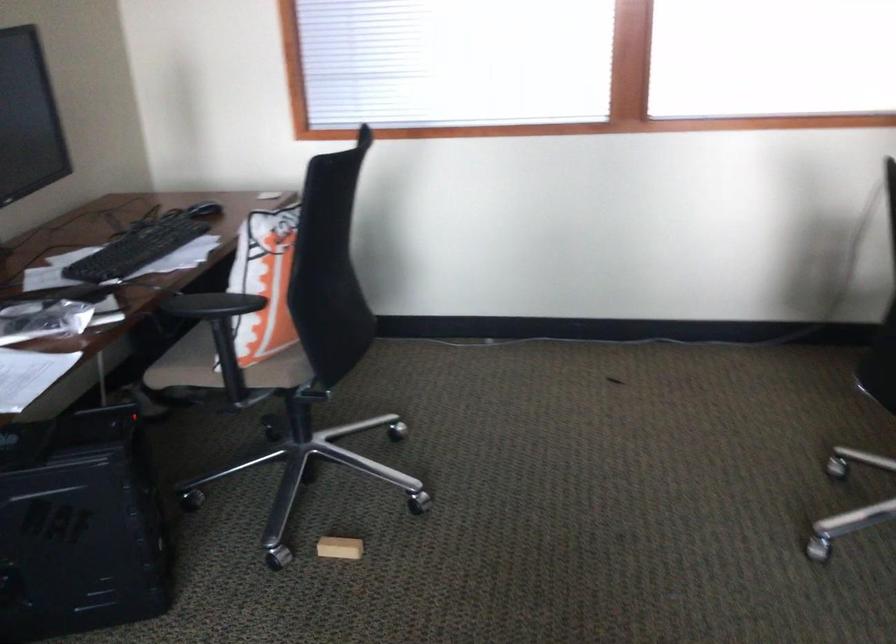
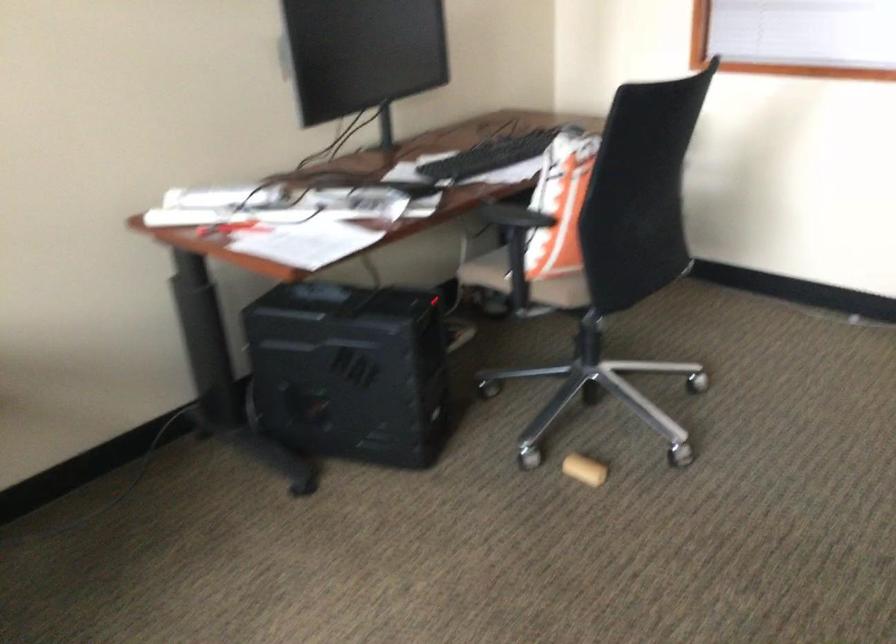
Question: How did the camera likely rotate?

Choices:
 (A) Left
 (B) Right
 (C) Up
 (D) Down

Answer: (A)